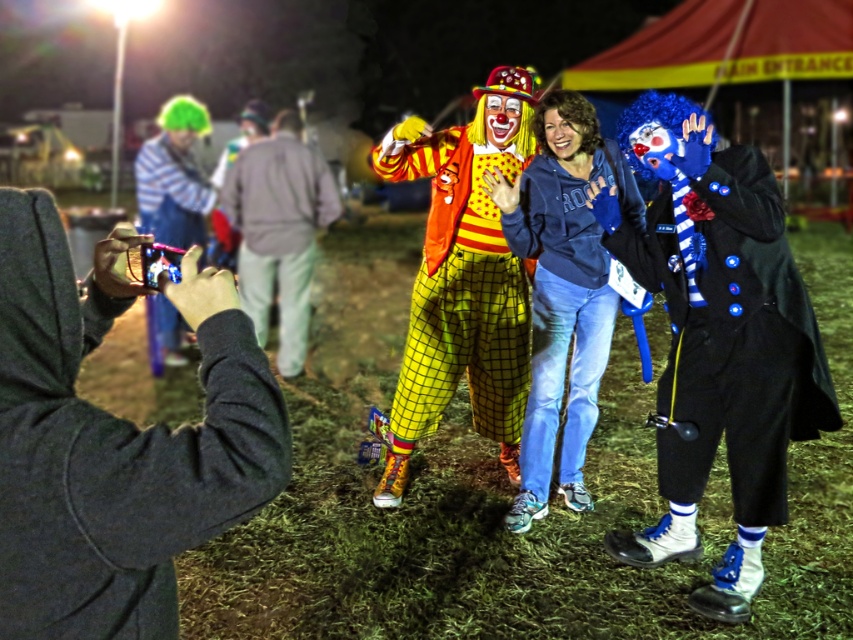
You are taking a photo of the two clowns and want to ensure that both clowns are in focus. You notice two points in the image labeled as point 1 at coordinates (273, 224) and point 2 at coordinates (155, 154). Based on their positions, which point is closer to the camera and should be prioritized for focus adjustment?

Point 1 at coordinates (273, 224) is closer to the camera and should be prioritized for focus adjustment because it is further to the viewer than point 2 at coordinates (155, 154).